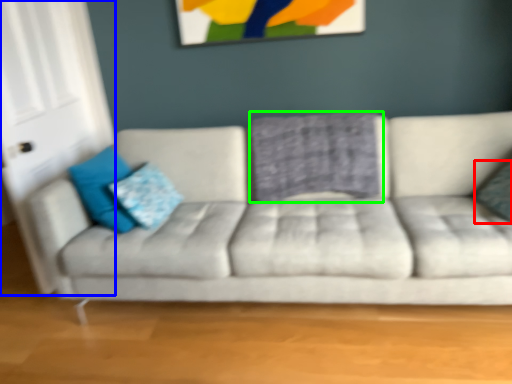
Question: Based on their relative distances, which object is nearer to pillow (highlighted by a red box)? Choose from glass door (highlighted by a blue box) and pillow (highlighted by a green box).

Choices:
 (A) glass door
 (B) pillow

Answer: (B)